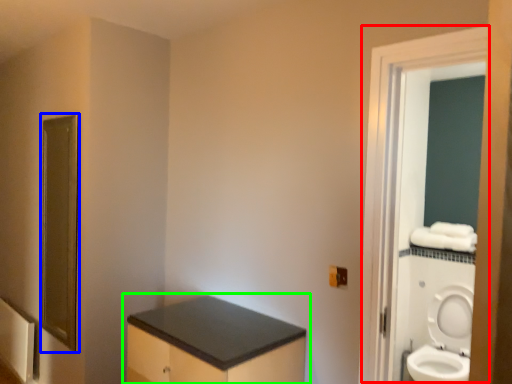
Question: Which object is the farthest from screen door (highlighted by a red box)? Choose among these: mirror (highlighted by a blue box) or bathroom cabinet (highlighted by a green box).

Choices:
 (A) mirror
 (B) bathroom cabinet

Answer: (A)